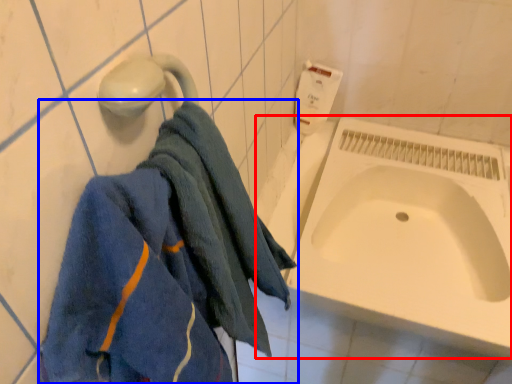
Question: Among these objects, which one is nearest to the camera, bath (highlighted by a red box) or towel (highlighted by a blue box)?

Choices:
 (A) bath
 (B) towel

Answer: (B)